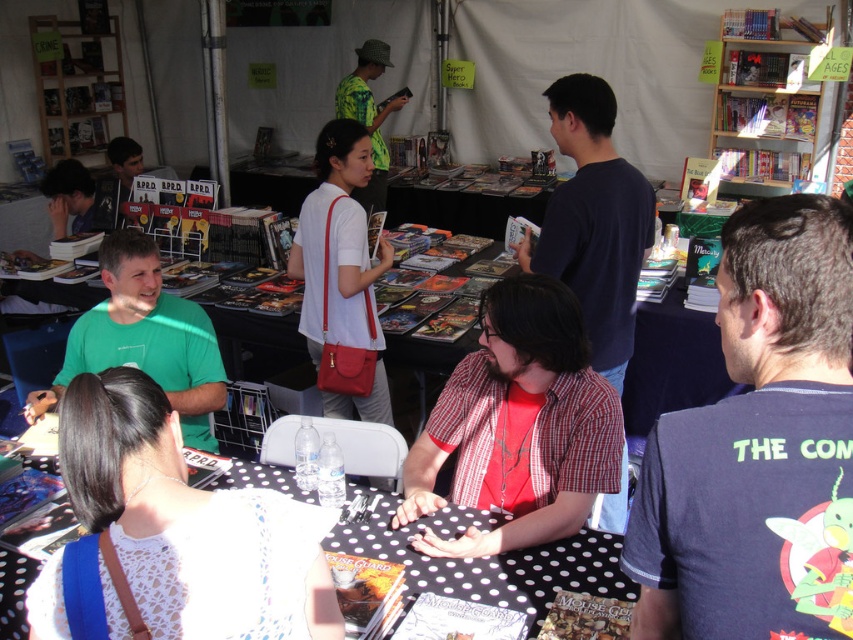
You are an attendee at the convention and want to approach the vendor at the table. Which vendor should you approach first, the one wearing the red plaid shirt at center or the matte black shirt at upper left, based on their positions?

The matte black shirt at upper left is positioned higher up, so you should approach the vendor wearing the matte black shirt at upper left first as they are located at a higher position relative to the red plaid shirt at center.